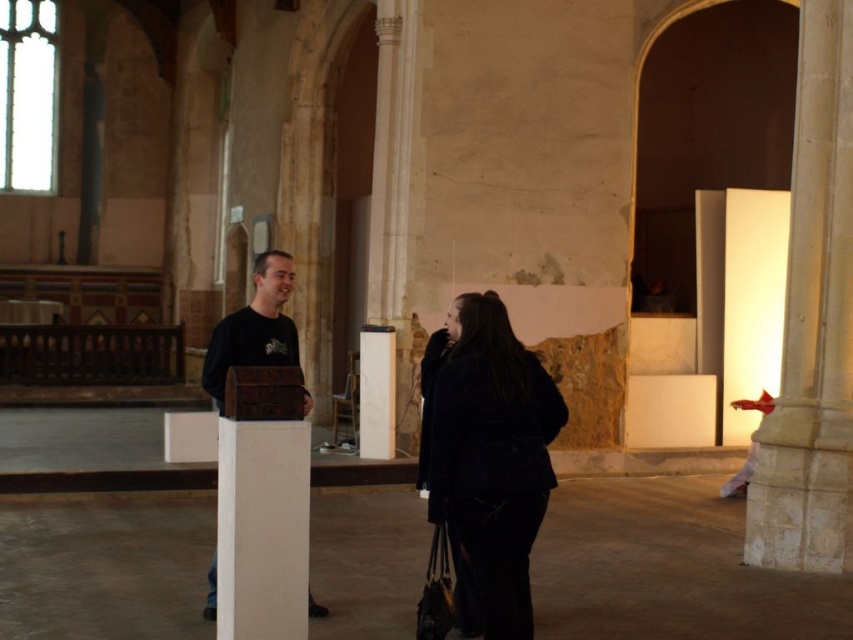
Looking at this image, you are standing in the historic building and need to locate the dark blue wool coat at center. According to the coordinates provided, where exactly is it positioned?

The dark blue wool coat at center is located at point 0.719 along the x axis and 0.572 along the y axis.

You are an interior designer planning to install a new lighting fixture in this historic building. You need to ensure that the fixture will be taller than both the dark blue wool coat at center and the brown leather chest at center. What is the minimum height the lighting fixture must be?

The dark blue wool coat at center is shorter than the brown leather chest at center. Therefore, the lighting fixture must be taller than the brown leather chest at center, which is the taller object between the two. The minimum height should be just over the height of the brown leather chest at center to meet the requirement.